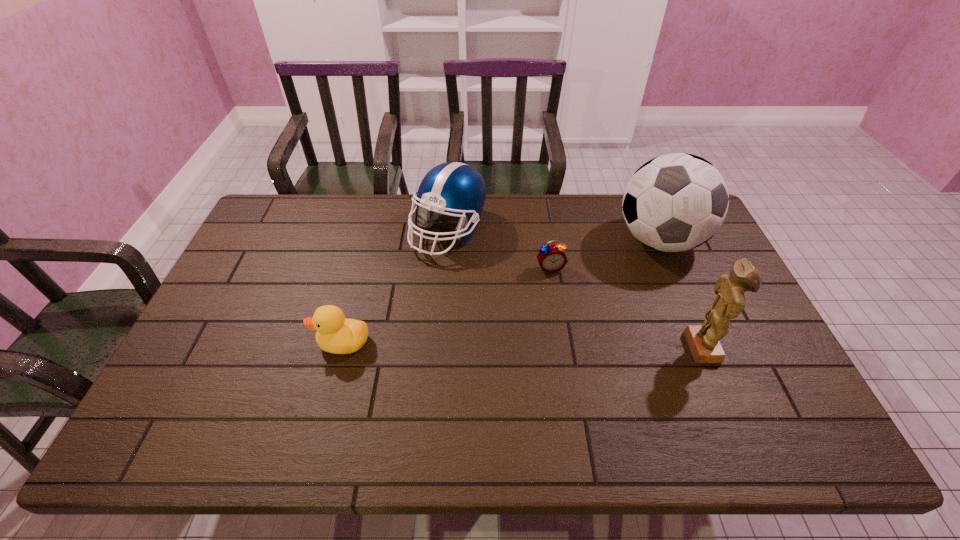
Where is `vacant space on the desktop that is between the leftmost object and the figurine and is positioned on the main logo of the soccer ball`? The image size is (960, 540). vacant space on the desktop that is between the leftmost object and the figurine and is positioned on the main logo of the soccer ball is located at coordinates (530, 345).

The width and height of the screenshot is (960, 540). I want to click on free space on the desktop that is between the duck and the figurine and is positioned on the front-facing side of the alarm clock, so tap(577, 346).

Image resolution: width=960 pixels, height=540 pixels. I want to click on free spot on the desktop that is between the duck and the figurine and is positioned at the front of the second object from left to right with the faceguard, so click(472, 344).